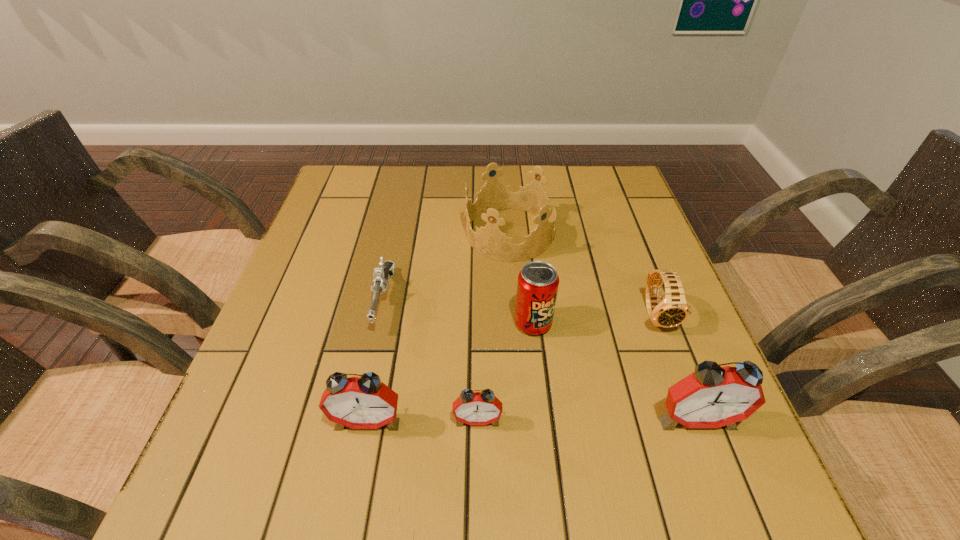
To achieve uniform spacing by inserting another alarm_clock among them, please point to a free space for this new alarm_clock. Please provide its 2D coordinates. Your answer should be formatted as a tuple, i.e. [(x, y)], where the tuple contains the x and y coordinates of a point satisfying the conditions above.

[(587, 420)]